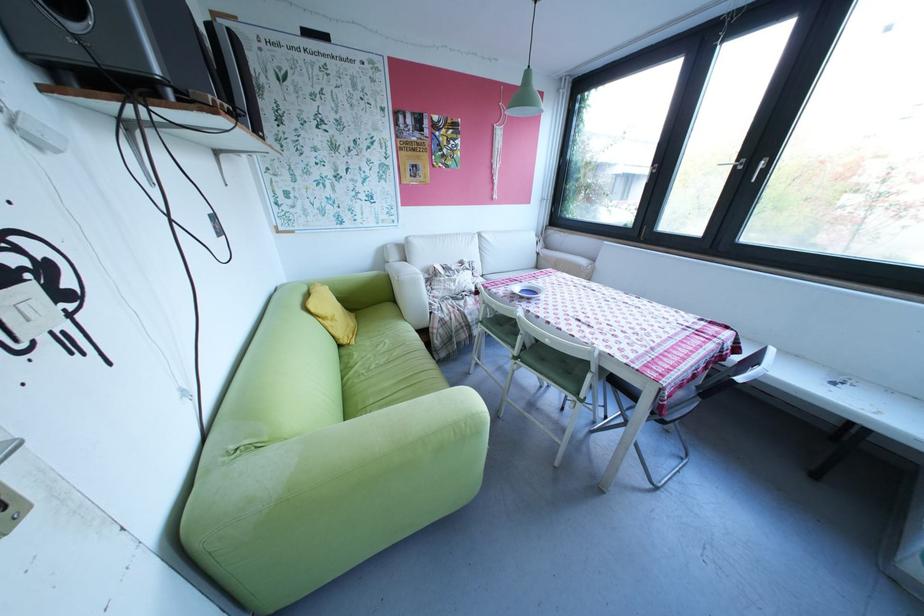
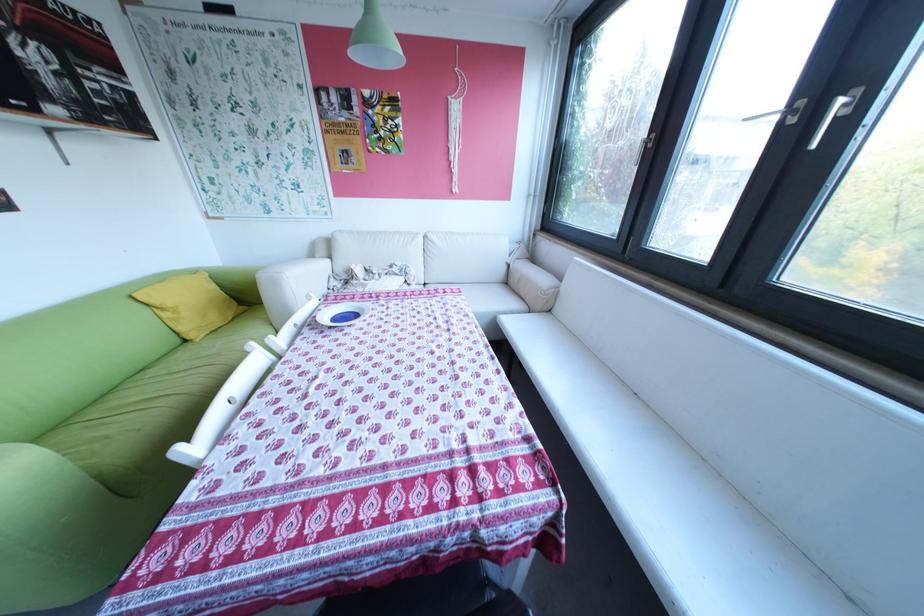
Consider the image. In a continuous first-person perspective shot, in which direction is the camera moving?

The cameraman walked toward right, forward.